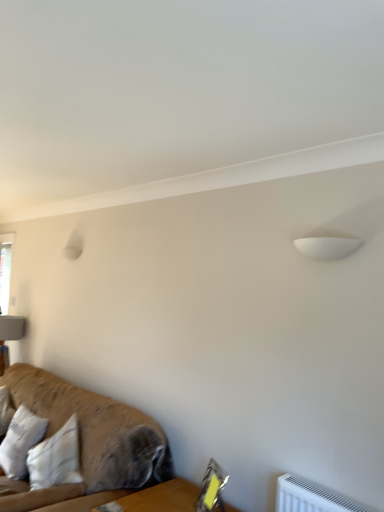
Question: Is point (23, 418) closer or farther from the camera than point (140, 475)?

Choices:
 (A) farther
 (B) closer

Answer: (A)

Question: In terms of height, does white cotton pillow at lower left look taller or shorter compared to textured brown fabric couch at lower left?

Choices:
 (A) short
 (B) tall

Answer: (A)

Question: From the image's perspective, is white cotton pillow at lower left positioned above or below textured brown fabric couch at lower left?

Choices:
 (A) above
 (B) below

Answer: (B)

Question: Choose the correct answer: Is textured brown fabric couch at lower left inside white cotton pillow at lower left or outside it?

Choices:
 (A) outside
 (B) inside

Answer: (A)

Question: From a real-world perspective, relative to white cotton pillow at lower left, is textured brown fabric couch at lower left vertically above or below?

Choices:
 (A) above
 (B) below

Answer: (A)

Question: Does point (150, 483) appear closer or farther from the camera than point (18, 446)?

Choices:
 (A) closer
 (B) farther

Answer: (A)

Question: From the image's perspective, is textured brown fabric couch at lower left positioned above or below white cotton pillow at lower left?

Choices:
 (A) below
 (B) above

Answer: (B)